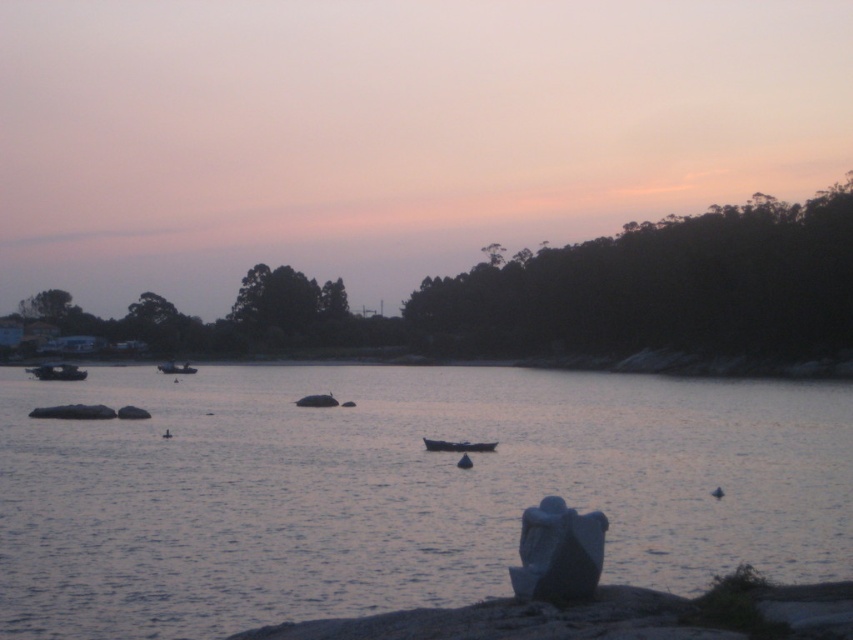
Is dull blue water at center positioned behind metallic gray boat at center?

No, it is not.

Does dull blue water at center have a larger size compared to metallic gray boat at center?

Correct, dull blue water at center is larger in size than metallic gray boat at center.

Is point (157, 483) closer to camera compared to point (437, 442)?

Yes, point (157, 483) is closer to viewer.

Locate an element on the screen. Image resolution: width=853 pixels, height=640 pixels. dull blue water at center is located at coordinates (395, 490).

Does metallic gray boat at left have a greater height compared to metallic gray boat at center?

Yes.

Does point (62, 369) lie behind point (466, 451)?

Yes, it is.

Which is in front, point (68, 365) or point (486, 442)?

Point (486, 442) is more forward.

Find the location of a particular element. The image size is (853, 640). metallic gray boat at left is located at coordinates pos(57,371).

Who is higher up, metallic gray boat at center or smooth gray rock at center?

smooth gray rock at center is above.

Does metallic gray boat at center have a lesser height compared to smooth gray rock at center?

Yes.

Image resolution: width=853 pixels, height=640 pixels. I want to click on metallic gray boat at center, so click(x=457, y=445).

Find the location of `metallic gray boat at center`. metallic gray boat at center is located at coordinates (457, 445).